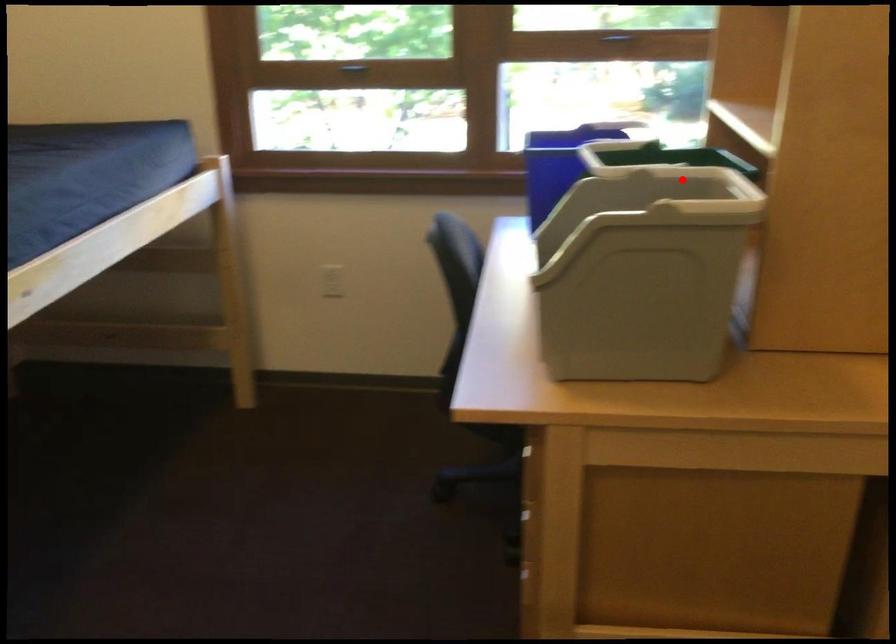
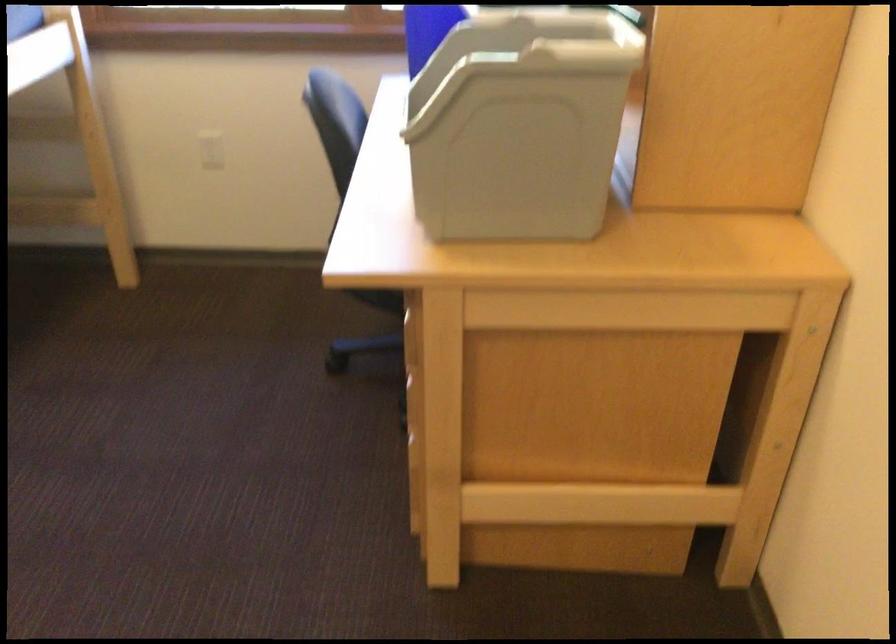
Where in the second image is the point corresponding to the highlighted location from the first image?

(565, 24)